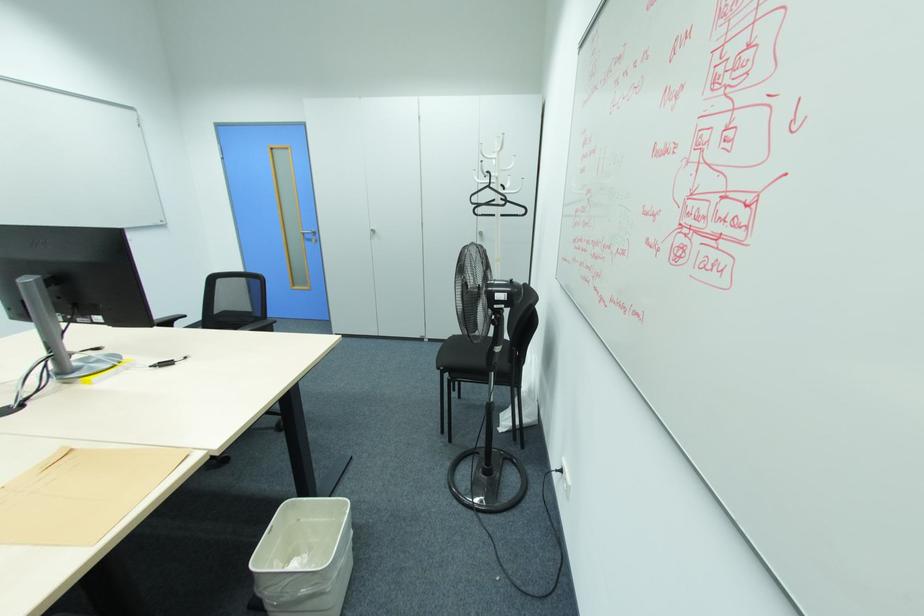
Find the location of `chair armrest`. chair armrest is located at coordinates [260, 325].